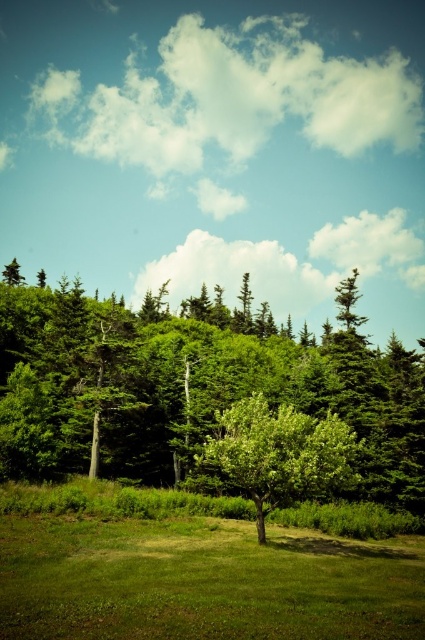
Question: Which object appears farthest from the camera in this image?

Choices:
 (A) green leafy trees at center
 (B) green grass at center

Answer: (A)

Question: Does green leafy trees at center have a lesser width compared to green grass at center?

Choices:
 (A) no
 (B) yes

Answer: (A)

Question: Which of the following is the closest to the observer?

Choices:
 (A) (306, 424)
 (B) (306, 618)

Answer: (B)

Question: Estimate the real-world distances between objects in this image. Which object is closer to the green leafy tree at center?

Choices:
 (A) green leafy trees at center
 (B) green grass at center

Answer: (B)

Question: Can you confirm if green leafy trees at center is smaller than green grass at center?

Choices:
 (A) yes
 (B) no

Answer: (B)

Question: Does green leafy trees at center appear on the right side of green leafy tree at center?

Choices:
 (A) yes
 (B) no

Answer: (B)